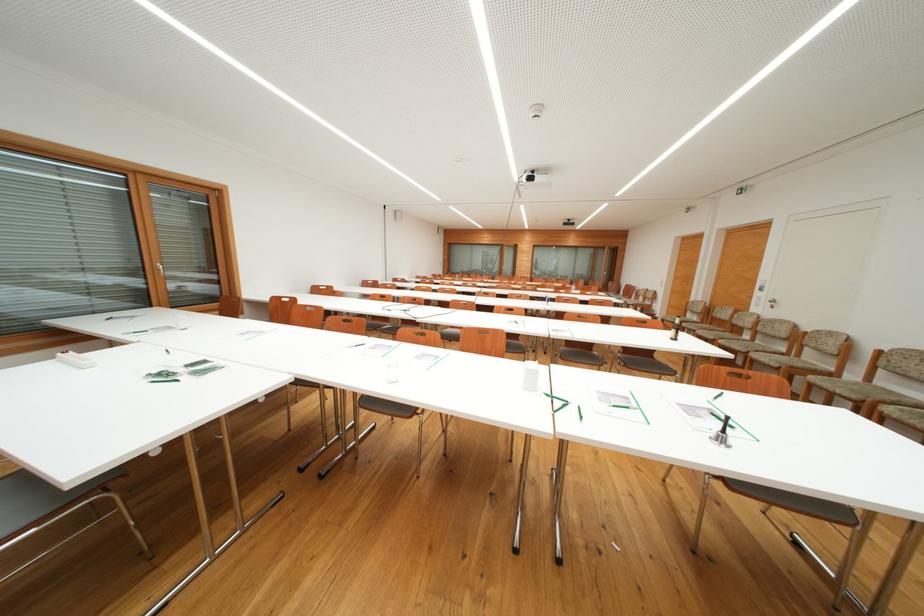
I want to click on small service bell, so click(722, 434).